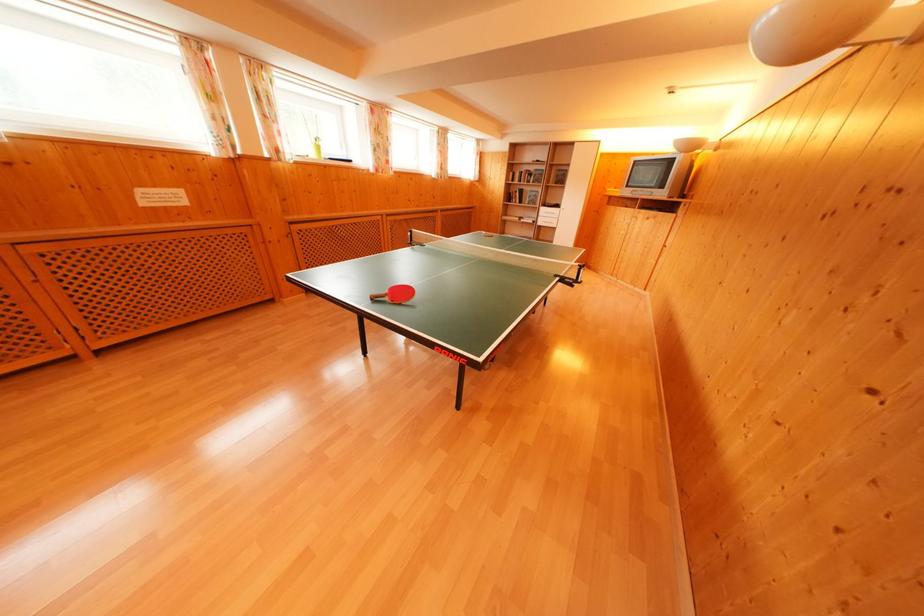
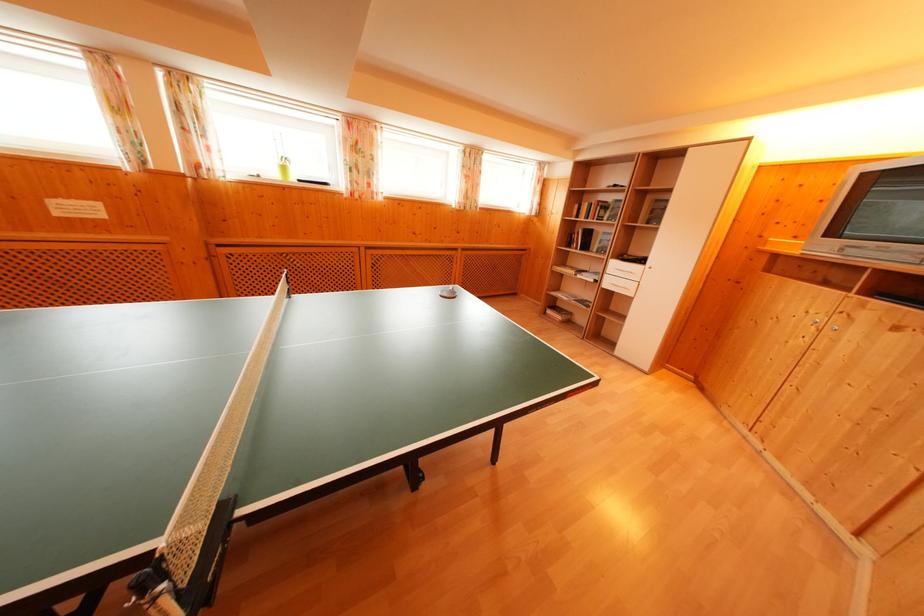
Question: I am providing you with two images of the same scene from different viewpoints. Which of the following objects are not visible in image2?

Choices:
 (A) book on shelf
 (B) white drawer pull
 (C) green plant pot
 (D) none of these

Answer: (D)